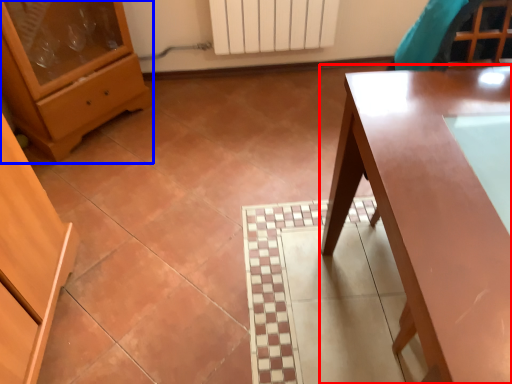
Question: Which object is closer to the camera taking this photo, table (highlighted by a red box) or chest of drawers (highlighted by a blue box)?

Choices:
 (A) table
 (B) chest of drawers

Answer: (A)